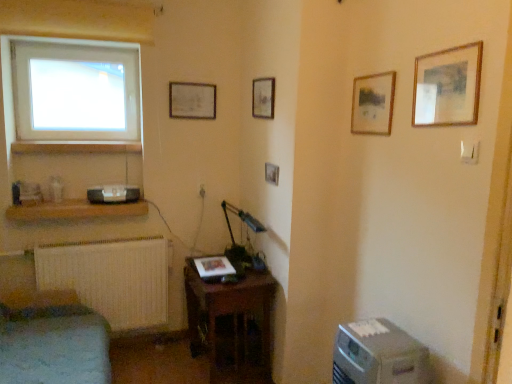
Question: Considering the positions of wooden shelf at lower left, the 2th shelf in the top-to-bottom sequence, and matte black speaker at lower left in the image, is wooden shelf at lower left, the 2th shelf in the top-to-bottom sequence, taller or shorter than matte black speaker at lower left?

Choices:
 (A) short
 (B) tall

Answer: (A)

Question: From a real-world perspective, relative to matte black speaker at lower left, is wooden shelf at lower left, the 2th shelf in the top-to-bottom sequence, vertically above or below?

Choices:
 (A) above
 (B) below

Answer: (B)

Question: Estimate the real-world distances between objects in this image. Which object is farther from the wooden picture frame at center, the second picture frame when ordered from back to front?

Choices:
 (A) metallic gray desktop computer at lower right
 (B) wooden shelf at lower left, which appears as the second shelf when ordered from the bottom
 (C) matte wooden picture frame at upper center, which ranks as the 5th picture frame in right-to-left order
 (D) metallic gray table lamp at lower center
 (E) wooden table at lower center

Answer: (A)

Question: Which is farther from the wooden shelf at lower left, the 2th shelf in the top-to-bottom sequence?

Choices:
 (A) wooden table at lower center
 (B) metallic gray desktop computer at lower right
 (C) matte black speaker at lower left
 (D) velvet green sofa at lower left
 (E) transparent glass window at upper left

Answer: (B)